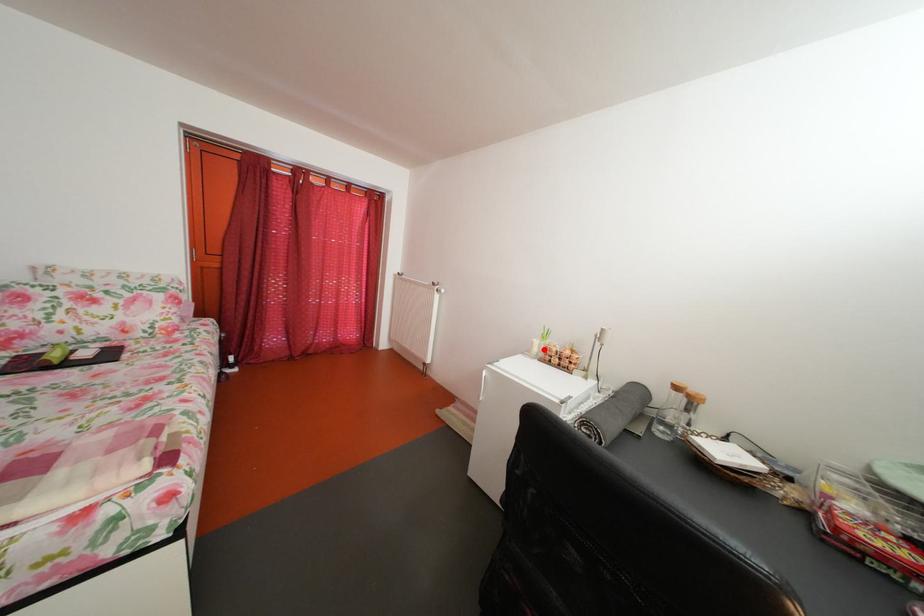
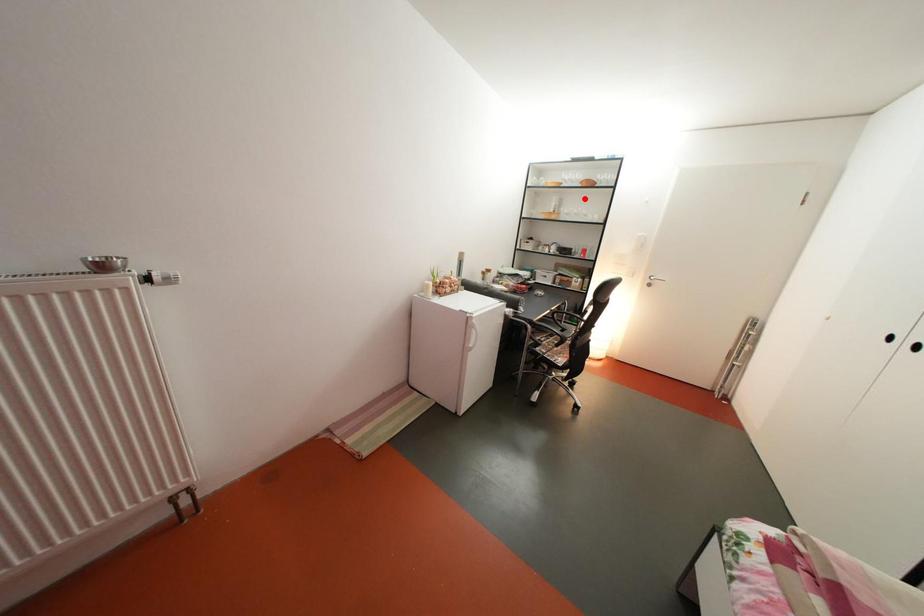
I am providing you with two images of the same scene from different viewpoints. A red point is marked on the first image and another point is marked on the second image. Is the marked point in image1 the same physical position as the marked point in image2?

No